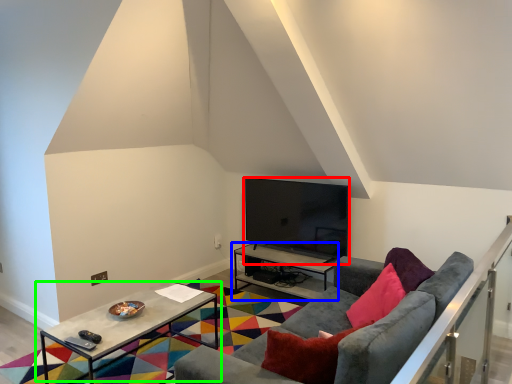
Question: Which object is positioned farthest from television (highlighted by a red box)? Select from table (highlighted by a blue box) and table (highlighted by a green box).

Choices:
 (A) table
 (B) table

Answer: (B)